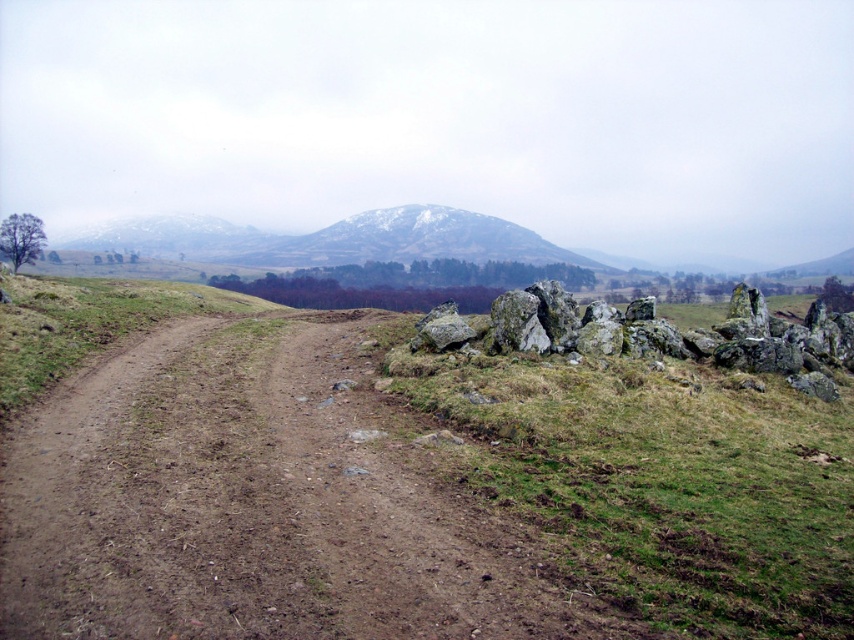
You are a hiker planning to walk along the dirt path in the image. You notice the green grassy at right and the rough textured rocks at right. Which of these two features is closer to you as you stand on the dirt path?

The green grassy at right is closer to you because it is in front of the rough textured rocks at right, meaning the grass is nearer to your position on the dirt path.

You are planning to walk along the brown dirt track at center and pass by the rough textured rocks at right. Considering their sizes, which one would you need to step over or around?

The rough textured rocks at right are larger than the brown dirt track at center, so you would need to step over or around the rough textured rocks at right.

You are a hiker carrying a backpack and want to cross the brown dirt track at center. There are two large stones on either side of the track. How far apart are these stones from each other?

The two large stones on either side of the brown dirt track at center are 4.61 meters apart.